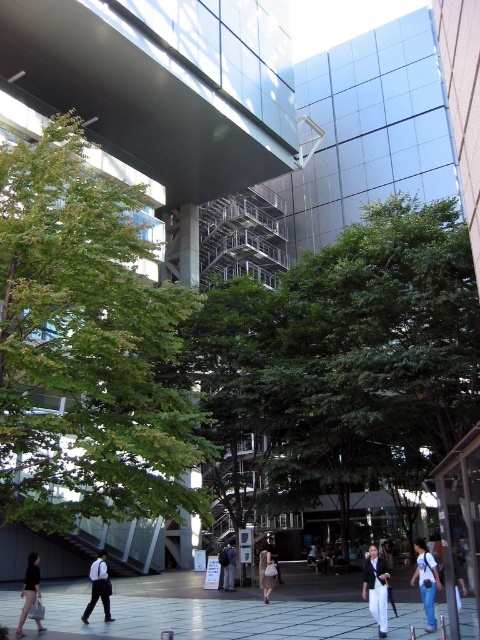
Question: In this image, where is smooth concrete pavement at center located relative to white shirt at center?

Choices:
 (A) above
 (B) below

Answer: (B)

Question: Which object is positioned farthest from the light brown fabric skirt at center?

Choices:
 (A) white shirt at center
 (B) white cotton pants at lower center

Answer: (B)

Question: Is the position of denim jeans at lower right less distant than that of dark blue jeans at center?

Choices:
 (A) yes
 (B) no

Answer: (A)

Question: Which object is closer to the camera taking this photo?

Choices:
 (A) white shirt at center
 (B) denim jeans at lower right
 (C) light brown fabric skirt at center
 (D) dark gray fabric bag at lower left

Answer: (B)

Question: Does green leafy tree at center appear over white shirt at center?

Choices:
 (A) yes
 (B) no

Answer: (A)

Question: Among these points, which one is nearest to the camera?

Choices:
 (A) (103, 552)
 (B) (151, 598)
 (C) (287, 486)
 (D) (224, 556)

Answer: (A)